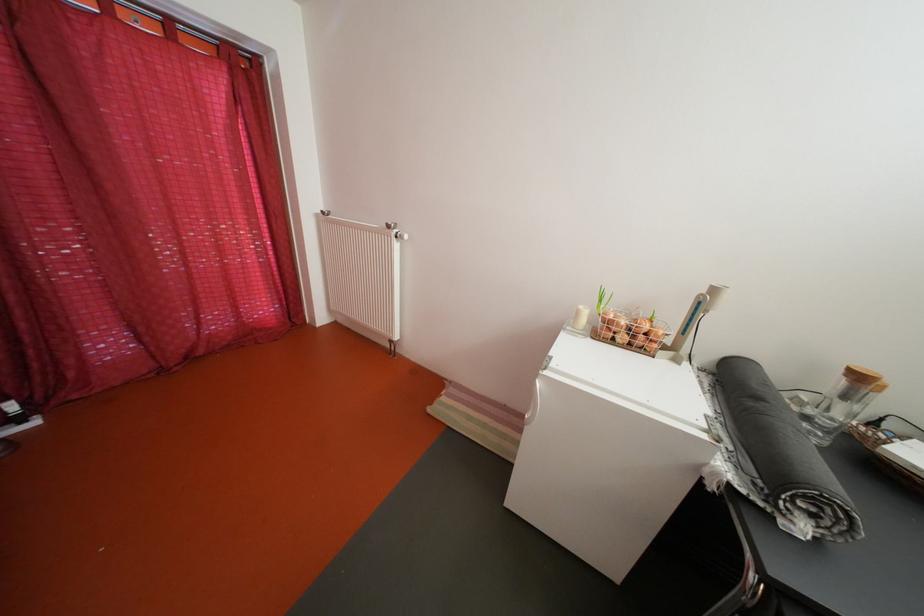
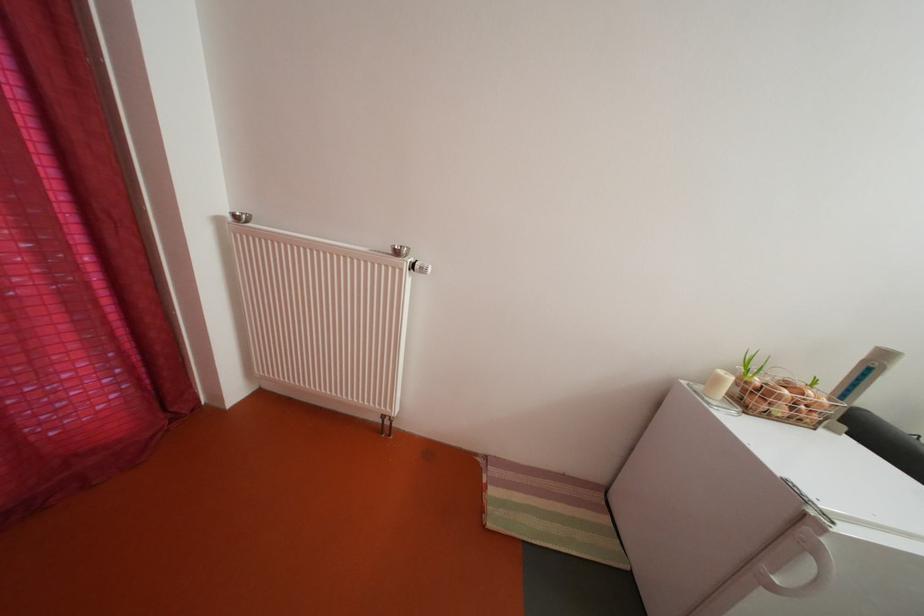
Find the pixel in the second image that matches point 635,345 in the first image.

(792, 416)